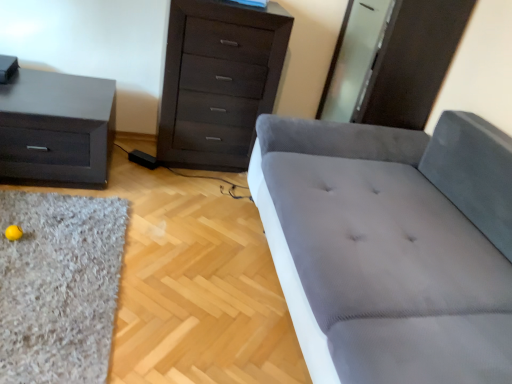
Question: From the image's perspective, is matte black nightstand at left positioned above or below shaggy gray rug at lower left?

Choices:
 (A) below
 (B) above

Answer: (B)

Question: In the image, is matte black nightstand at left positioned in front of or behind shaggy gray rug at lower left?

Choices:
 (A) behind
 (B) front

Answer: (A)

Question: Estimate the real-world distances between objects in this image. Which object is closer to the matte black nightstand at left?

Choices:
 (A) gray fabric studio couch at center
 (B) shaggy gray rug at lower left
 (C) dark wood chest of drawers at upper center

Answer: (B)

Question: Which is nearer to the gray fabric studio couch at center?

Choices:
 (A) matte black nightstand at left
 (B) shaggy gray rug at lower left
 (C) dark wood chest of drawers at upper center

Answer: (C)